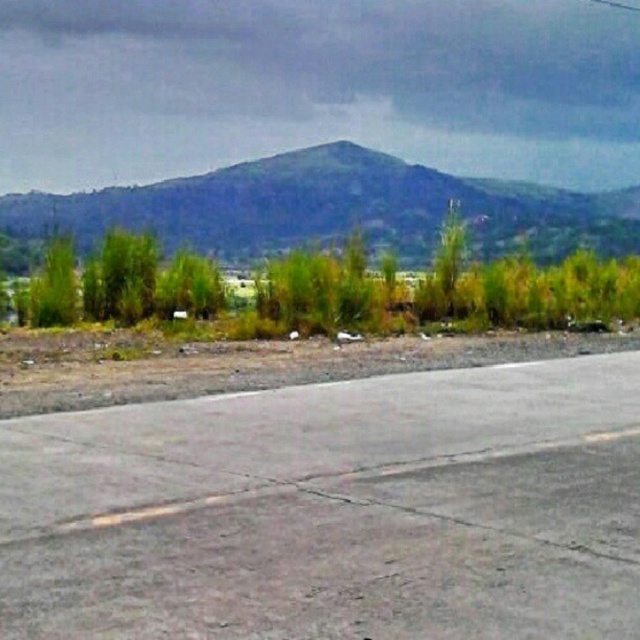
Between gray asphalt tarmac at lower center and green grassy hill at upper center, which one has less height?

gray asphalt tarmac at lower center is shorter.

Is gray asphalt tarmac at lower center positioned in front of green grassy hill at upper center?

Yes, gray asphalt tarmac at lower center is closer to the viewer.

What do you see at coordinates (333, 509) in the screenshot? This screenshot has width=640, height=640. I see `gray asphalt tarmac at lower center` at bounding box center [333, 509].

Locate an element on the screen. gray asphalt tarmac at lower center is located at coordinates (333, 509).